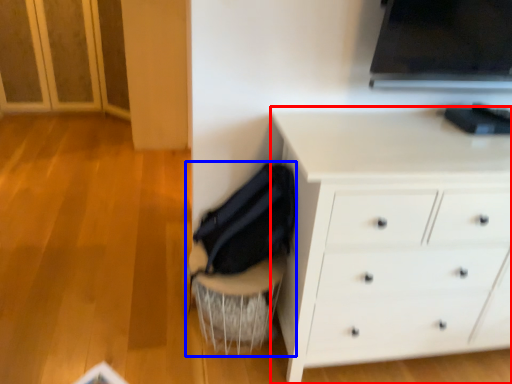
Question: Which object is further to the camera taking this photo, chest of drawers (highlighted by a red box) or swivel chair (highlighted by a blue box)?

Choices:
 (A) chest of drawers
 (B) swivel chair

Answer: (B)